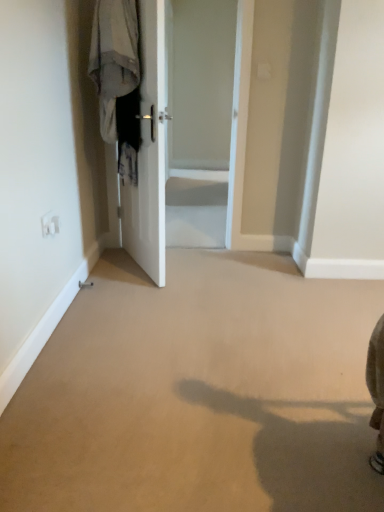
Question: Are white glossy door at center and white glossy door at center far apart?

Choices:
 (A) yes
 (B) no

Answer: (A)

Question: From the image's perspective, is white glossy door at center beneath white glossy door at center?

Choices:
 (A) no
 (B) yes

Answer: (A)

Question: Does white glossy door at center turn towards white glossy door at center?

Choices:
 (A) yes
 (B) no

Answer: (B)

Question: Can you confirm if white glossy door at center is positioned to the left of white glossy door at center?

Choices:
 (A) no
 (B) yes

Answer: (A)

Question: Can you confirm if white glossy door at center is thinner than white glossy door at center?

Choices:
 (A) no
 (B) yes

Answer: (A)

Question: Can you confirm if white glossy door at center is shorter than white glossy door at center?

Choices:
 (A) yes
 (B) no

Answer: (B)

Question: From the image's perspective, is light gray fabric at left over white glossy door at center?

Choices:
 (A) yes
 (B) no

Answer: (A)

Question: From a real-world perspective, is light gray fabric at left positioned under white glossy door at center based on gravity?

Choices:
 (A) no
 (B) yes

Answer: (A)

Question: Can you confirm if light gray fabric at left is bigger than white glossy door at center?

Choices:
 (A) no
 (B) yes

Answer: (A)

Question: Is light gray fabric at left smaller than white glossy door at center?

Choices:
 (A) yes
 (B) no

Answer: (A)

Question: Is white glossy door at center inside light gray fabric at left?

Choices:
 (A) no
 (B) yes

Answer: (A)

Question: Does light gray fabric at left have a lesser height compared to white glossy door at center?

Choices:
 (A) yes
 (B) no

Answer: (A)

Question: Considering the relative positions of white glossy door at center and light gray fabric at left in the image provided, is white glossy door at center behind light gray fabric at left?

Choices:
 (A) yes
 (B) no

Answer: (A)